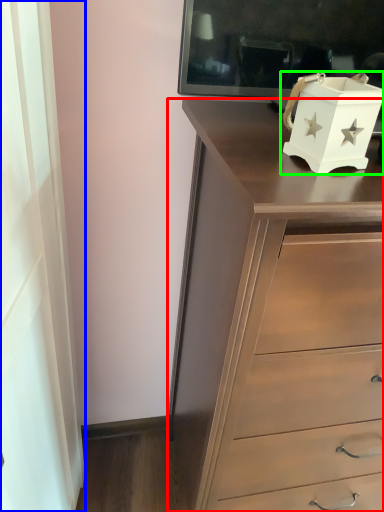
Question: Based on their relative distances, which object is nearer to chest of drawers (highlighted by a red box)? Choose from curtain (highlighted by a blue box) and box (highlighted by a green box).

Choices:
 (A) curtain
 (B) box

Answer: (B)